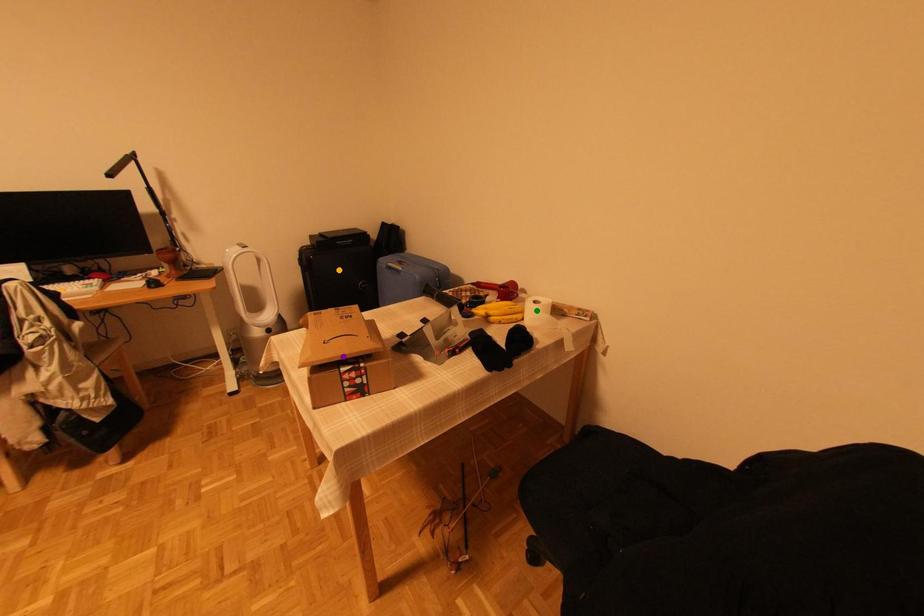
Order these from nearest to farthest:
1. orange point
2. purple point
3. green point

purple point, green point, orange point